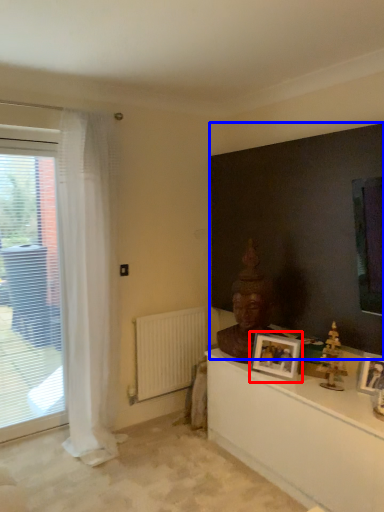
Question: Which point is closer to the camera, picture frame (highlighted by a red box) or backdrop (highlighted by a blue box)?

Choices:
 (A) picture frame
 (B) backdrop

Answer: (B)